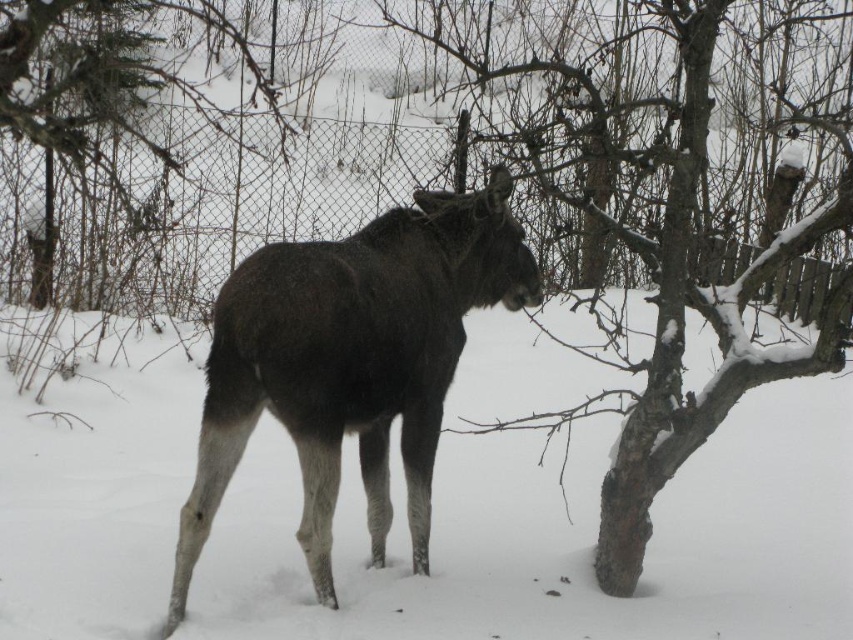
Between dark brown fur donkey at center and snow-covered bark tree at left, which one has less height?

dark brown fur donkey at center

Consider the image. Does dark brown fur donkey at center have a larger size compared to snow-covered bark tree at left?

Actually, dark brown fur donkey at center might be smaller than snow-covered bark tree at left.

Which is behind, point (410, 509) or point (39, 253)?

The point (39, 253) is more distant.

Image resolution: width=853 pixels, height=640 pixels. What are the coordinates of `dark brown fur donkey at center` in the screenshot? It's located at (351, 362).

Is dark brown fur donkey at center taller than wire mesh fence at center?

Correct, dark brown fur donkey at center is much taller as wire mesh fence at center.

Locate an element on the screen. This screenshot has height=640, width=853. dark brown fur donkey at center is located at coordinates (351, 362).

The width and height of the screenshot is (853, 640). I want to click on dark brown fur donkey at center, so click(351, 362).

Does wire mesh fence at center appear over snow-covered bark tree at left?

Actually, wire mesh fence at center is below snow-covered bark tree at left.

How far apart are wire mesh fence at center and snow-covered bark tree at left?

wire mesh fence at center is 1.25 meters away from snow-covered bark tree at left.

What do you see at coordinates (199, 209) in the screenshot?
I see `wire mesh fence at center` at bounding box center [199, 209].

You are a GUI agent. You are given a task and a screenshot of the screen. Output one action in this format:
    pyautogui.click(x=<x>, y=<y>)
    Task: Click on the wire mesh fence at center
    The image size is (853, 640).
    Given the screenshot: What is the action you would take?
    pyautogui.click(x=199, y=209)